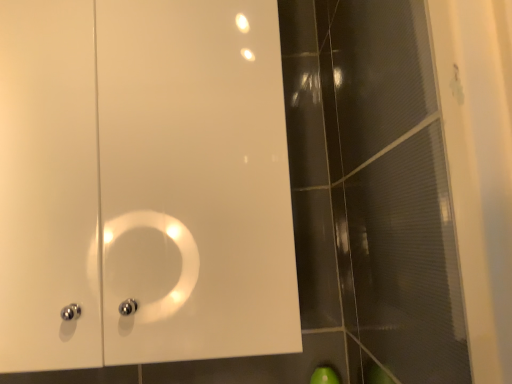
Image resolution: width=512 pixels, height=384 pixels. Describe the element at coordinates (369, 196) in the screenshot. I see `transparent textured glass door at right` at that location.

I want to click on transparent textured glass door at right, so 369,196.

In order to face white glossy cabinet at upper left, should I rotate leftwards or rightwards?

To align with it, rotate left about 17.180°.

At what (x,y) coordinates should I click in order to perform the action: click on white glossy cabinet at upper left. Please return your answer as a coordinate pair (x, y). This screenshot has width=512, height=384. Looking at the image, I should click on (143, 184).

What do you see at coordinates (143, 184) in the screenshot? I see `white glossy cabinet at upper left` at bounding box center [143, 184].

Identify the location of transparent textured glass door at right. The image size is (512, 384). (369, 196).

In the scene shown: Based on their positions, is transparent textured glass door at right located to the left or right of white glossy cabinet at upper left?

From the image, it's evident that transparent textured glass door at right is to the right of white glossy cabinet at upper left.

Which is behind, transparent textured glass door at right or white glossy cabinet at upper left?

white glossy cabinet at upper left is further from the camera.

Which is closer to the camera, (374,117) or (32,60)?

Point (374,117) appears to be closer to the viewer than point (32,60).

From the image's perspective, which is above, transparent textured glass door at right or white glossy cabinet at upper left?

From the image's view, white glossy cabinet at upper left is above.

From a real-world perspective, which is physically below, transparent textured glass door at right or white glossy cabinet at upper left?

transparent textured glass door at right.

In terms of width, does transparent textured glass door at right look wider or thinner when compared to white glossy cabinet at upper left?

Considering their sizes, transparent textured glass door at right looks slimmer than white glossy cabinet at upper left.

Considering the relative sizes of transparent textured glass door at right and white glossy cabinet at upper left in the image provided, is transparent textured glass door at right taller than white glossy cabinet at upper left?

Correct, transparent textured glass door at right is much taller as white glossy cabinet at upper left.

Is transparent textured glass door at right bigger than white glossy cabinet at upper left?

Actually, transparent textured glass door at right might be smaller than white glossy cabinet at upper left.

Can white glossy cabinet at upper left be found inside transparent textured glass door at right?

That's incorrect, white glossy cabinet at upper left is not inside transparent textured glass door at right.

Is transparent textured glass door at right placed right next to white glossy cabinet at upper left?

transparent textured glass door at right is not next to white glossy cabinet at upper left, and they're not touching.

Is transparent textured glass door at right aimed at white glossy cabinet at upper left?

No, transparent textured glass door at right is not facing towards white glossy cabinet at upper left.

Where is `glass door below the white glossy cabinet at upper left (from a real-world perspective)`? The image size is (512, 384). glass door below the white glossy cabinet at upper left (from a real-world perspective) is located at coordinates 369,196.

Which is more to the right, white glossy cabinet at upper left or transparent textured glass door at right?

Positioned to the right is transparent textured glass door at right.

Which object is closer to the camera, white glossy cabinet at upper left or transparent textured glass door at right?

transparent textured glass door at right is in front.

Is point (260, 184) positioned before point (405, 146)?

No, (260, 184) is behind (405, 146).

From the image's perspective, is white glossy cabinet at upper left located above transparent textured glass door at right?

Yes.

From a real-world perspective, is white glossy cabinet at upper left over transparent textured glass door at right?

Yes.

Considering the sizes of objects white glossy cabinet at upper left and transparent textured glass door at right in the image provided, who is thinner, white glossy cabinet at upper left or transparent textured glass door at right?

With smaller width is transparent textured glass door at right.

In the scene shown: Who is shorter, white glossy cabinet at upper left or transparent textured glass door at right?

white glossy cabinet at upper left is shorter.

Is white glossy cabinet at upper left bigger or smaller than transparent textured glass door at right?

white glossy cabinet at upper left is bigger than transparent textured glass door at right.

Is white glossy cabinet at upper left positioned beyond the bounds of transparent textured glass door at right?

Absolutely, white glossy cabinet at upper left is external to transparent textured glass door at right.

Looking at this image, is white glossy cabinet at upper left beside transparent textured glass door at right?

No, white glossy cabinet at upper left is not in contact with transparent textured glass door at right.

Is white glossy cabinet at upper left looking in the opposite direction of transparent textured glass door at right?

No, white glossy cabinet at upper left is not facing the opposite direction of transparent textured glass door at right.

Where is `door positioned vertically above the transparent textured glass door at right (from a real-world perspective)`? door positioned vertically above the transparent textured glass door at right (from a real-world perspective) is located at coordinates (143, 184).

Identify the location of glass door that appears in front of the white glossy cabinet at upper left. This screenshot has width=512, height=384. (369, 196).

Where is `door above the transparent textured glass door at right (from the image's perspective)`? This screenshot has width=512, height=384. door above the transparent textured glass door at right (from the image's perspective) is located at coordinates (143, 184).